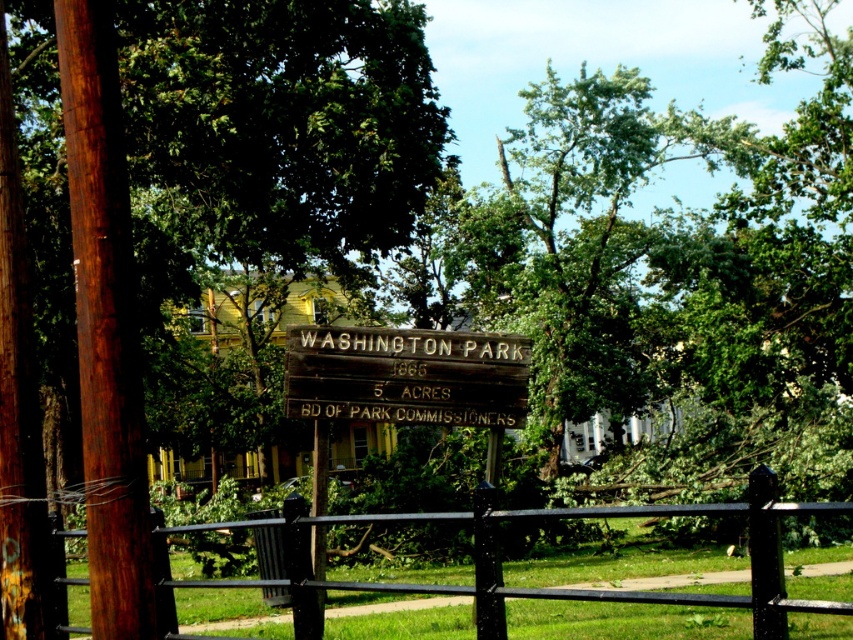
Question: Is green leafy tree at center wider than black metal fence at center?

Choices:
 (A) no
 (B) yes

Answer: (B)

Question: Which of the following is the closest to the observer?

Choices:
 (A) black metal fence at center
 (B) wooden sign at center

Answer: (A)

Question: Considering the relative positions of green leafy tree at center and black metal fence at center in the image provided, where is green leafy tree at center located with respect to black metal fence at center?

Choices:
 (A) right
 (B) left

Answer: (B)

Question: Which point is farther to the camera?

Choices:
 (A) black metal fence at center
 (B) wooden sign at center
 (C) green leafy tree at center

Answer: (B)

Question: Which point is closer to the camera taking this photo?

Choices:
 (A) (468, 417)
 (B) (305, 595)
 (C) (277, 196)

Answer: (B)

Question: Can you confirm if wooden sign at center is smaller than black metal fence at center?

Choices:
 (A) yes
 (B) no

Answer: (B)